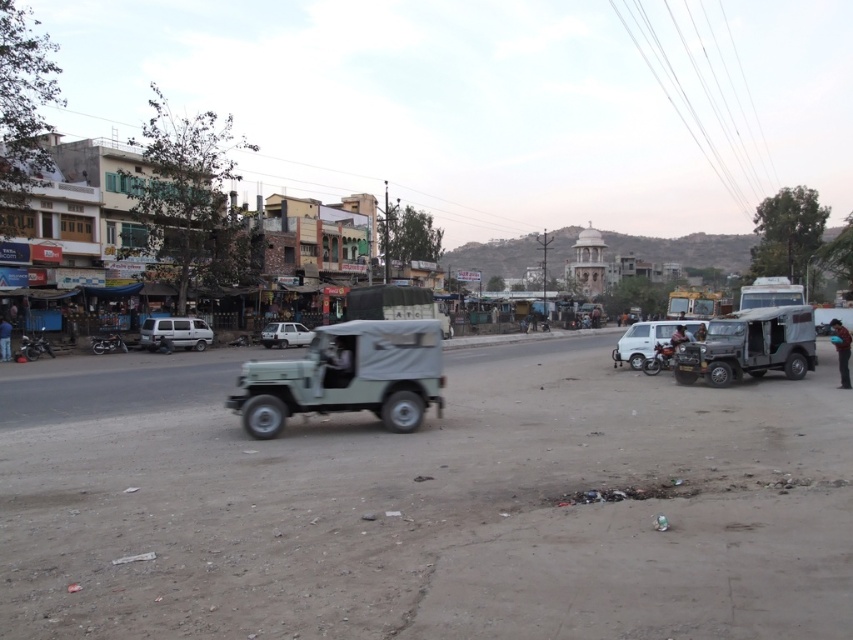
Question: Considering the relative positions of silver metallic van at center and shiny metallic motorcycle at center-right in the image provided, where is silver metallic van at center located with respect to shiny metallic motorcycle at center-right?

Choices:
 (A) above
 (B) below

Answer: (A)

Question: Which is nearer to the dark blue leather jacket at right?

Choices:
 (A) blue jeans at lower left
 (B) brown leather jacket at center

Answer: (B)

Question: Which point is closer to the camera?

Choices:
 (A) shiny black motorcycle at left
 (B) light green canvas jeep at center
 (C) silver metallic van at center

Answer: (B)

Question: Which object is farther from the camera taking this photo?

Choices:
 (A) matte green jeep at center
 (B) light green canvas jeep at center
 (C) blue jeans at lower left
 (D) shiny black motorcycle at left

Answer: (D)

Question: Does silver metallic van at center appear over brown leather jacket at center?

Choices:
 (A) no
 (B) yes

Answer: (B)

Question: Does matte green jeep at center appear under shiny black motorcycle at left?

Choices:
 (A) no
 (B) yes

Answer: (A)